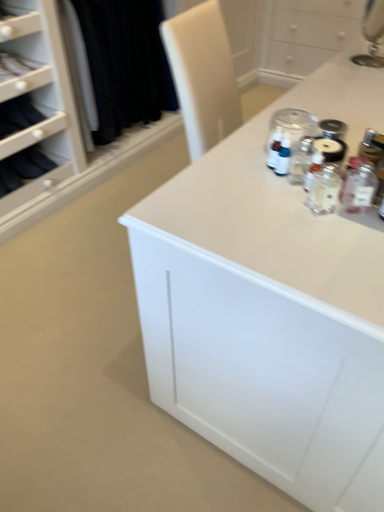
Question: Should I look upward or downward to see white glossy countertop at upper right?

Choices:
 (A) up
 (B) down

Answer: (A)

Question: Is clear glass jar at upper center completely or partially outside of clear glass bottle at center, which is the first bottle in left-to-right order?

Choices:
 (A) yes
 (B) no

Answer: (A)

Question: Does clear glass jar at upper center appear on the right side of clear glass bottle at center, which is the first bottle in left-to-right order?

Choices:
 (A) no
 (B) yes

Answer: (A)

Question: From a real-world perspective, is clear glass jar at upper center under clear glass bottle at center, acting as the second bottle starting from the right?

Choices:
 (A) no
 (B) yes

Answer: (A)

Question: Is clear glass jar at upper center oriented away from clear glass bottle at center, which is the first bottle in left-to-right order?

Choices:
 (A) yes
 (B) no

Answer: (B)

Question: Is clear glass jar at upper center taller than clear glass bottle at center, which is the first bottle in left-to-right order?

Choices:
 (A) no
 (B) yes

Answer: (A)

Question: From the image's perspective, would you say clear glass jar at upper center is shown under clear glass bottle at center, acting as the second bottle starting from the right?

Choices:
 (A) no
 (B) yes

Answer: (A)

Question: Does clear glass bottle at right, the 1th bottle in the right-to-left sequence, have a smaller size compared to clear glass jar at upper center?

Choices:
 (A) yes
 (B) no

Answer: (A)

Question: Does clear glass bottle at right, positioned as the second bottle in left-to-right order, come behind clear glass jar at upper center?

Choices:
 (A) yes
 (B) no

Answer: (B)

Question: From the image's perspective, would you say clear glass bottle at right, the 1th bottle in the right-to-left sequence, is positioned over clear glass jar at upper center?

Choices:
 (A) no
 (B) yes

Answer: (A)

Question: Considering the relative positions of clear glass bottle at right, positioned as the second bottle in left-to-right order, and clear glass jar at upper center in the image provided, is clear glass bottle at right, positioned as the second bottle in left-to-right order, to the left of clear glass jar at upper center from the viewer's perspective?

Choices:
 (A) no
 (B) yes

Answer: (A)

Question: Considering the relative sizes of clear glass bottle at right, positioned as the second bottle in left-to-right order, and clear glass jar at upper center in the image provided, is clear glass bottle at right, positioned as the second bottle in left-to-right order, thinner than clear glass jar at upper center?

Choices:
 (A) no
 (B) yes

Answer: (B)

Question: From a real-world perspective, is clear glass bottle at right, positioned as the second bottle in left-to-right order, beneath clear glass jar at upper center?

Choices:
 (A) yes
 (B) no

Answer: (B)

Question: Is there a large distance between clear glass bottle at center, acting as the second bottle starting from the right, and clear glass bottle at right, the 1th bottle in the right-to-left sequence?

Choices:
 (A) yes
 (B) no

Answer: (B)